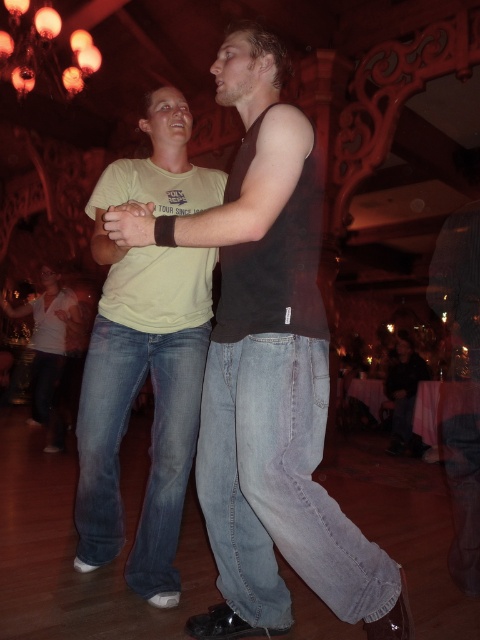
You are standing in the dance hall and want to approach the person wearing the dark brown tank top at center. The space between you and them is narrow. Can you walk through this space without bumping into them, considering your body width is 0.5 meters?

The distance between you and the dark brown tank top at center is 1.37 meters. Since your body width is 0.5 meters, you have enough space to walk through the space as 1.37 meters is greater than 0.5 meters.

You are standing in the dance hall and notice two items of clothing. The first is the matte black tank top at center, and the second is the white matte shirt at lower left. Which of these two items is positioned higher in the image?

The matte black tank top at center is located above the white matte shirt at lower left, so the matte black tank top at center is positioned higher in the image.

You are a photographer in the dance hall and want to capture a silhouette of both the matte black tank top at center and the white matte shirt at lower left. Which one will appear thinner in the photo?

The matte black tank top at center will appear thinner in the photo because it is thinner than the white matte shirt at lower left according to the description.